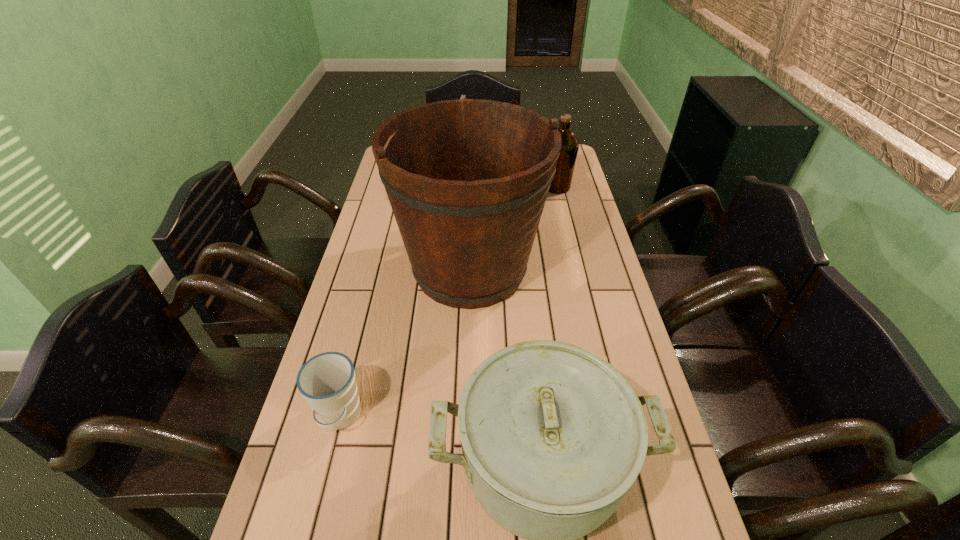
You are a GUI agent. You are given a task and a screenshot of the screen. Output one action in this format:
    pyautogui.click(x=<x>, y=<y>)
    Task: Click on the free space located with a handle on the side of the shortest object
    The image size is (960, 540).
    Given the screenshot: What is the action you would take?
    pyautogui.click(x=321, y=491)

You are a GUI agent. You are given a task and a screenshot of the screen. Output one action in this format:
    pyautogui.click(x=<x>, y=<y>)
    Task: Click on the object positioned at the far edge
    The width and height of the screenshot is (960, 540).
    Given the screenshot: What is the action you would take?
    pyautogui.click(x=463, y=96)

I want to click on bucket that is at the left edge, so click(x=467, y=179).

Where is `cup located at the left edge`? The height and width of the screenshot is (540, 960). cup located at the left edge is located at coordinates (327, 381).

Identify the location of object that is at the right edge. The image size is (960, 540). (561, 183).

The image size is (960, 540). Find the location of `vacant space at the left edge of the desktop`. vacant space at the left edge of the desktop is located at coordinates (356, 307).

At what (x,y) coordinates should I click in order to perform the action: click on vacant area at the right edge of the desktop. Please return your answer as a coordinate pair (x, y). Looking at the image, I should click on (592, 274).

At what (x,y) coordinates should I click in order to perform the action: click on free space between the shortest object and the third nearest object. Please return your answer as a coordinate pair (x, y). Looking at the image, I should click on (404, 343).

Locate an element on the screen. vacant point located between the bucket and the cup is located at coordinates (404, 343).

At what (x,y) coordinates should I click in order to perform the action: click on free spot between the tallest object and the cup. Please return your answer as a coordinate pair (x, y). Looking at the image, I should click on (404, 343).